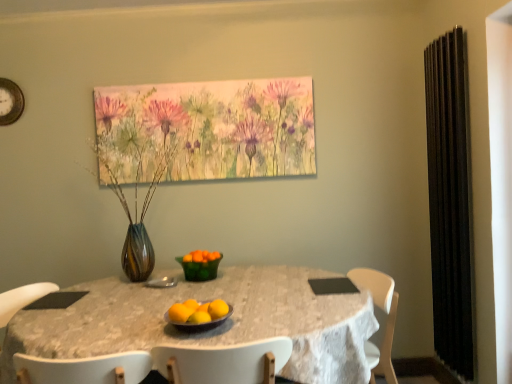
Question: Is the surface of white lace tablecloth at center in direct contact with gold metallic clock at upper left?

Choices:
 (A) no
 (B) yes

Answer: (A)

Question: Does white lace tablecloth at center come in front of gold metallic clock at upper left?

Choices:
 (A) yes
 (B) no

Answer: (A)

Question: From a real-world perspective, is white lace tablecloth at center on gold metallic clock at upper left?

Choices:
 (A) no
 (B) yes

Answer: (A)

Question: Does white lace tablecloth at center have a lesser width compared to gold metallic clock at upper left?

Choices:
 (A) no
 (B) yes

Answer: (A)

Question: Can you confirm if white lace tablecloth at center is positioned to the left of gold metallic clock at upper left?

Choices:
 (A) yes
 (B) no

Answer: (B)

Question: From a real-world perspective, is orange matte at center, which is counted as the first orange, starting from the right, above or below shiny metallic bowl at center?

Choices:
 (A) above
 (B) below

Answer: (A)

Question: Looking at their shapes, would you say orange matte at center, which appears as the second orange when viewed from the front, is wider or thinner than shiny metallic bowl at center?

Choices:
 (A) thin
 (B) wide

Answer: (A)

Question: Is orange matte at center, which appears as the second orange when viewed from the front, situated inside shiny metallic bowl at center or outside?

Choices:
 (A) outside
 (B) inside

Answer: (A)

Question: Looking at the image, does orange matte at center, which appears as the second orange when viewed from the front, seem bigger or smaller compared to shiny metallic bowl at center?

Choices:
 (A) big
 (B) small

Answer: (B)

Question: Based on their sizes in the image, would you say white lace tablecloth at center is bigger or smaller than orange matte at center, the second orange from the right?

Choices:
 (A) big
 (B) small

Answer: (A)

Question: Considering the positions of point (247, 288) and point (189, 302), is point (247, 288) closer or farther from the camera than point (189, 302)?

Choices:
 (A) farther
 (B) closer

Answer: (A)

Question: Is white lace tablecloth at center situated inside orange matte at center, acting as the first orange starting from the back, or outside?

Choices:
 (A) outside
 (B) inside

Answer: (A)

Question: From the image's perspective, is white lace tablecloth at center above or below orange matte at center, acting as the first orange starting from the back?

Choices:
 (A) below
 (B) above

Answer: (A)

Question: In the image, is multicolored glass vase with dried stems at center on the left side or the right side of orange matte at center, which appears as the 1th orange when viewed from the front?

Choices:
 (A) right
 (B) left

Answer: (B)

Question: Is multicolored glass vase with dried stems at center situated inside orange matte at center, the third orange in the right-to-left sequence, or outside?

Choices:
 (A) inside
 (B) outside

Answer: (B)